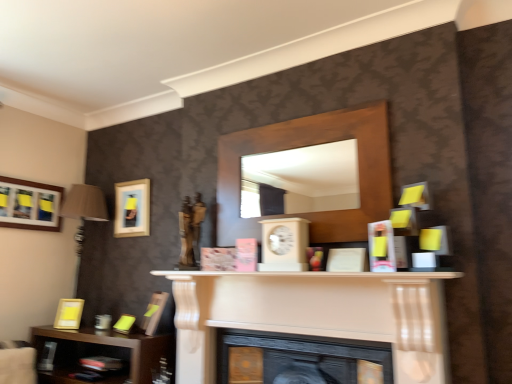
I want to click on free spot above wooden mirror at center, marked as the 2th shelf in a left-to-right arrangement (from a real-world perspective), so tap(290, 119).